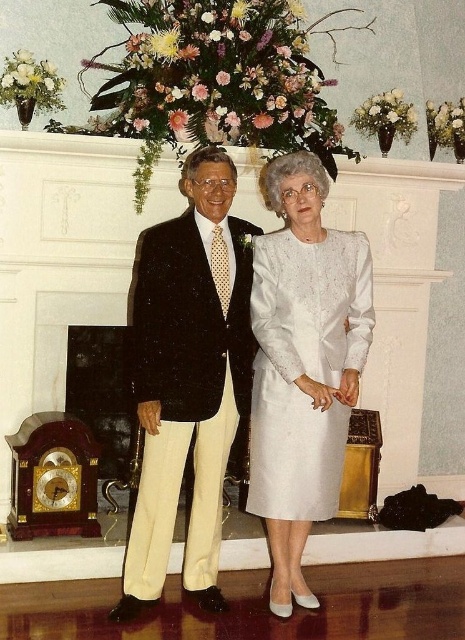
Question: From the image, what is the correct spatial relationship of matte black suit at center in relation to white satin dress at center?

Choices:
 (A) right
 (B) left

Answer: (B)

Question: Is matte black suit at center to the left of white satin dress at center from the viewer's perspective?

Choices:
 (A) no
 (B) yes

Answer: (B)

Question: Is matte black suit at center wider than white satin dress at center?

Choices:
 (A) no
 (B) yes

Answer: (B)

Question: Which of the following is the closest to the observer?

Choices:
 (A) (270, 502)
 (B) (227, 346)

Answer: (B)

Question: Which point appears farthest from the camera in this image?

Choices:
 (A) (251, 428)
 (B) (140, 365)

Answer: (A)